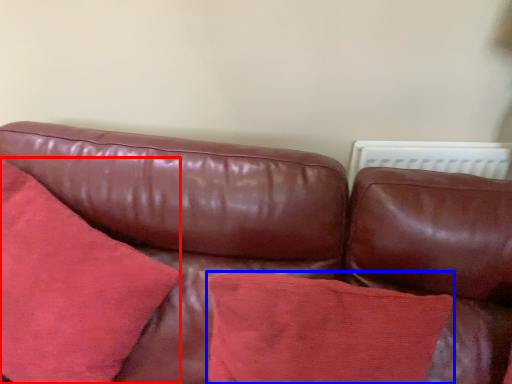
Question: Which of the following is the farthest to the observer, throw pillow (highlighted by a red box) or throw pillow (highlighted by a blue box)?

Choices:
 (A) throw pillow
 (B) throw pillow

Answer: (B)